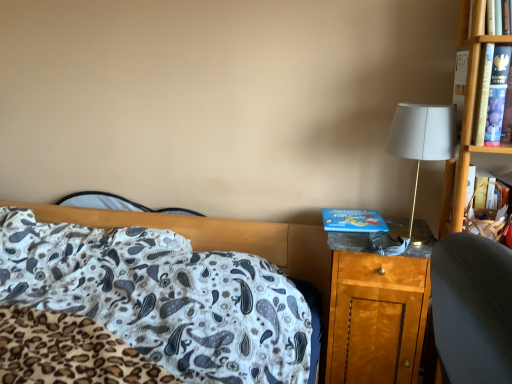
Question: Is wooden nightstand at right oriented away from white fabric lampshade at right?

Choices:
 (A) no
 (B) yes

Answer: (A)

Question: Is wooden nightstand at right positioned far away from white fabric lampshade at right?

Choices:
 (A) yes
 (B) no

Answer: (B)

Question: Does wooden nightstand at right have a greater height compared to white fabric lampshade at right?

Choices:
 (A) no
 (B) yes

Answer: (B)

Question: Does wooden nightstand at right have a lesser width compared to white fabric lampshade at right?

Choices:
 (A) yes
 (B) no

Answer: (B)

Question: Is wooden nightstand at right positioned in front of white fabric lampshade at right?

Choices:
 (A) no
 (B) yes

Answer: (A)

Question: Would you say wooden nightstand at right contains white fabric lampshade at right?

Choices:
 (A) yes
 (B) no

Answer: (B)

Question: Would you say blue cardboard book at right is outside white fabric lampshade at right?

Choices:
 (A) yes
 (B) no

Answer: (A)

Question: Is the surface of blue cardboard book at right in direct contact with white fabric lampshade at right?

Choices:
 (A) no
 (B) yes

Answer: (A)

Question: Can you confirm if blue cardboard book at right is taller than white fabric lampshade at right?

Choices:
 (A) yes
 (B) no

Answer: (B)

Question: From a real-world perspective, is blue cardboard book at right positioned under white fabric lampshade at right based on gravity?

Choices:
 (A) yes
 (B) no

Answer: (A)

Question: Is the depth of blue cardboard book at right less than that of white fabric lampshade at right?

Choices:
 (A) no
 (B) yes

Answer: (A)

Question: Considering the relative sizes of blue cardboard book at right and white fabric lampshade at right in the image provided, is blue cardboard book at right shorter than white fabric lampshade at right?

Choices:
 (A) yes
 (B) no

Answer: (A)

Question: Does white fabric lampshade at right have a larger size compared to white paisley fabric at center?

Choices:
 (A) yes
 (B) no

Answer: (B)